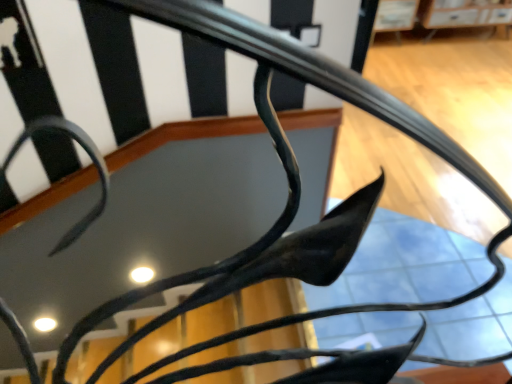
At what (x,y) coordinates should I click in order to perform the action: click on wooden cabinet at upper right. Please return your answer as a coordinate pair (x, y). This screenshot has height=384, width=512. Looking at the image, I should click on (465, 14).

What do you see at coordinates (465, 14) in the screenshot?
I see `wooden cabinet at upper right` at bounding box center [465, 14].

The width and height of the screenshot is (512, 384). I want to click on wooden cabinet at upper right, so click(465, 14).